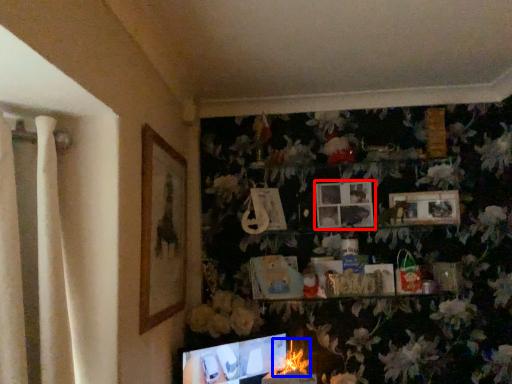
Question: Among these objects, which one is farthest to the camera, picture frame (highlighted by a red box) or flower (highlighted by a blue box)?

Choices:
 (A) picture frame
 (B) flower

Answer: (A)